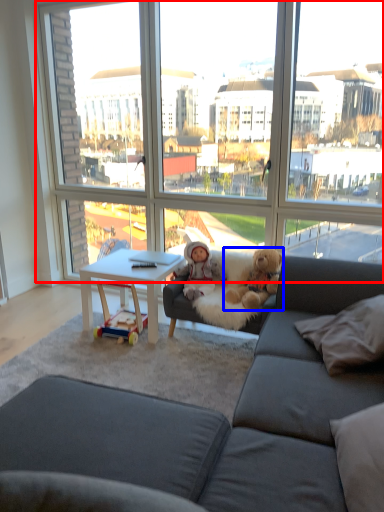
Question: Which of the following is the closest to the observer, window (highlighted by a red box) or teddy bear (highlighted by a blue box)?

Choices:
 (A) window
 (B) teddy bear

Answer: (A)